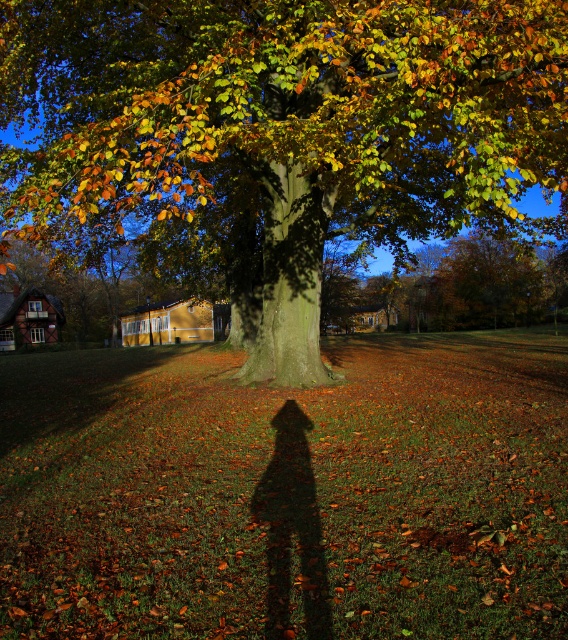
The image size is (568, 640). Describe the element at coordinates (286, 124) in the screenshot. I see `green rough bark tree at center` at that location.

Measure the distance between green rough bark tree at center and green leafy tree at upper center.

A distance of 19.35 meters exists between green rough bark tree at center and green leafy tree at upper center.

Between point (315, 12) and point (527, 260), which one is positioned in front?

Point (315, 12) is in front.

Locate an element on the screen. This screenshot has height=640, width=568. green rough bark tree at center is located at coordinates (286, 124).